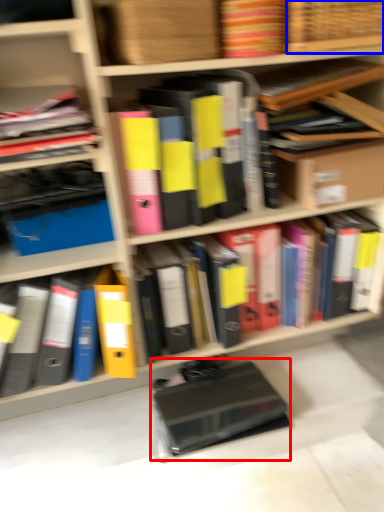
Question: Which object appears farthest to the camera in this image, paperback book (highlighted by a red box) or basket (highlighted by a blue box)?

Choices:
 (A) paperback book
 (B) basket

Answer: (A)